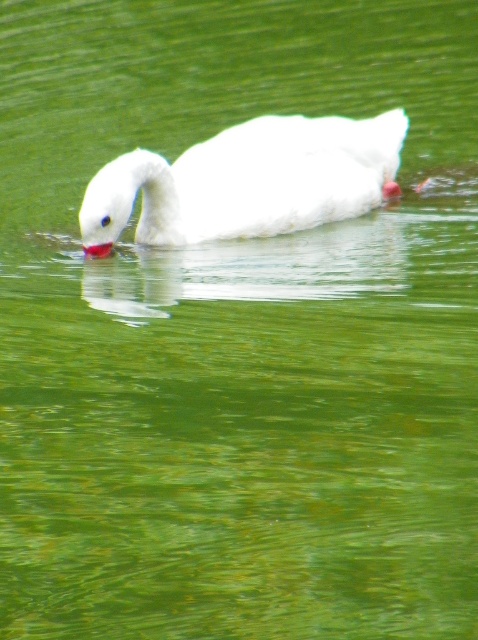
You are a photographer trying to capture the white matte swan at center and the matte red beak at center in a single shot. Based on their positions, which object should you adjust your camera to focus on first to ensure both are in frame?

The white matte swan at center is positioned on the right side of the matte red beak at center, so you should focus on the matte red beak at center first to ensure both are in frame.

In the scene shown: You are a photographer trying to capture a closeup of the white matte swan at center and the matte red beak at center. Which object should you zoom in on to ensure both are clearly visible in the frame?

The white matte swan at center is larger than the matte red beak at center, so zooming in on the white matte swan at center will ensure both are clearly visible in the frame.